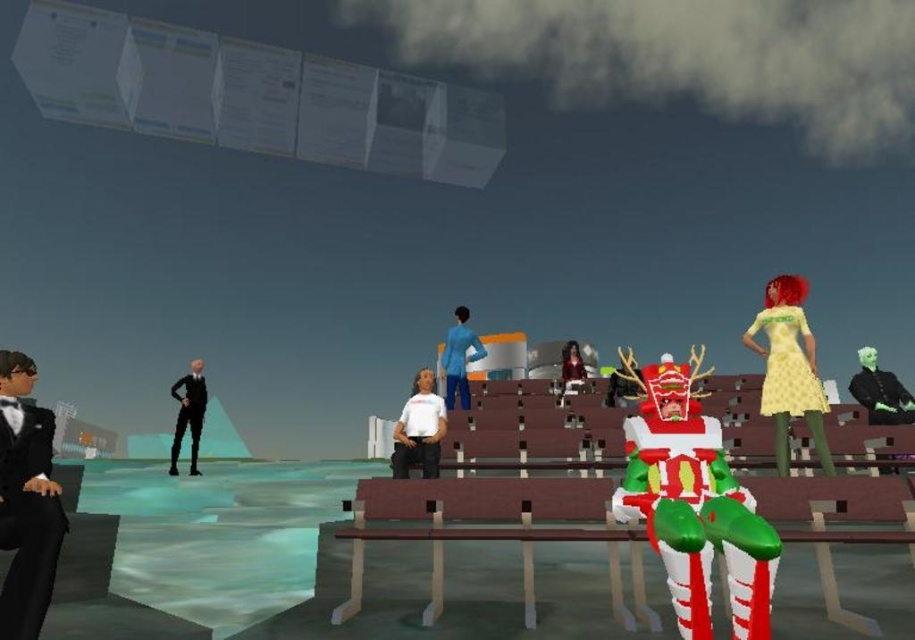
Question: Does white matte shirt at center lie behind blue matte shirt at center?

Choices:
 (A) no
 (B) yes

Answer: (A)

Question: Which point is closer to the camera?

Choices:
 (A) green matte/soft person at right
 (B) black satin suit at left
 (C) blue matte shirt at center
 (D) white matte shirt at center

Answer: (B)

Question: Observing the image, what is the correct spatial positioning of green matte/soft person at right in reference to shiny black jacket at center?

Choices:
 (A) right
 (B) left

Answer: (A)

Question: Does black satin suit at left have a greater width compared to shiny black jacket at center?

Choices:
 (A) no
 (B) yes

Answer: (A)

Question: Which object is positioned closest to the blue matte shirt at center?

Choices:
 (A) black satin suit at left
 (B) wooden bench at center
 (C) shiny black jacket at center

Answer: (C)

Question: Which object is closer to the camera taking this photo?

Choices:
 (A) shiny black jacket at center
 (B) black matte suit at left
 (C) green matte/soft person at right

Answer: (C)